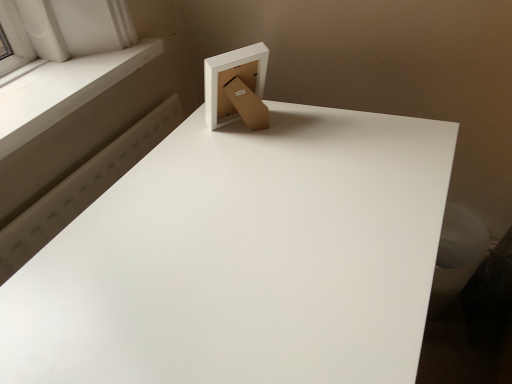
What is the approximate width of white smooth window sill at upper left?

9.32 inches.

The image size is (512, 384). Describe the element at coordinates (63, 91) in the screenshot. I see `white smooth window sill at upper left` at that location.

Find the location of a particular element. matte cardboard box at upper center is located at coordinates (232, 80).

From the image's perspective, between white matte table at upper center and white smooth window sill at upper left, who is located below?

white matte table at upper center appears lower in the image.

Between white matte table at upper center and white smooth window sill at upper left, which one is positioned in front?

white matte table at upper center is in front.

Looking at this image, who is smaller, white matte table at upper center or white smooth window sill at upper left?

With smaller size is white smooth window sill at upper left.

Considering the sizes of objects white matte table at upper center and matte cardboard box at upper center in the image provided, who is smaller, white matte table at upper center or matte cardboard box at upper center?

With smaller size is matte cardboard box at upper center.

Considering the relative sizes of white matte table at upper center and matte cardboard box at upper center in the image provided, is white matte table at upper center taller than matte cardboard box at upper center?

Yes, white matte table at upper center is taller than matte cardboard box at upper center.

Which is farther, (372, 369) or (263, 52)?

The point (263, 52) is behind.

Which of these two, white matte table at upper center or matte cardboard box at upper center, is wider?

white matte table at upper center.

Is white smooth window sill at upper left thinner than white matte table at upper center?

Yes.

Looking at the image, does white smooth window sill at upper left seem bigger or smaller compared to white matte table at upper center?

Considering their sizes, white smooth window sill at upper left takes up less space than white matte table at upper center.

Find the location of `table lying on the right of white smooth window sill at upper left`. table lying on the right of white smooth window sill at upper left is located at coordinates (244, 259).

Is white smooth window sill at upper left far from matte cardboard box at upper center?

No, white smooth window sill at upper left is in close proximity to matte cardboard box at upper center.

Which of these two, white smooth window sill at upper left or matte cardboard box at upper center, stands shorter?

With less height is white smooth window sill at upper left.

Which point is more distant from viewer, [71,90] or [208,109]?

The point [71,90] is farther from the camera.

From a real-world perspective, is white smooth window sill at upper left beneath matte cardboard box at upper center?

Yes, from a real-world perspective, white smooth window sill at upper left is beneath matte cardboard box at upper center.

From a real-world perspective, who is located higher, matte cardboard box at upper center or white smooth window sill at upper left?

matte cardboard box at upper center.

Considering the sizes of objects matte cardboard box at upper center and white smooth window sill at upper left in the image provided, who is shorter, matte cardboard box at upper center or white smooth window sill at upper left?

With less height is white smooth window sill at upper left.

Find the location of a particular element. window sill in front of the matte cardboard box at upper center is located at coordinates (63, 91).

Is matte cardboard box at upper center surrounding white matte table at upper center?

No, matte cardboard box at upper center does not contain white matte table at upper center.

Considering the relative sizes of matte cardboard box at upper center and white matte table at upper center in the image provided, is matte cardboard box at upper center wider than white matte table at upper center?

In fact, matte cardboard box at upper center might be narrower than white matte table at upper center.

In the scene shown: From the image's perspective, which is below, matte cardboard box at upper center or white matte table at upper center?

white matte table at upper center appears lower in the image.

Where is `table below the white smooth window sill at upper left (from the image's perspective)`? The height and width of the screenshot is (384, 512). table below the white smooth window sill at upper left (from the image's perspective) is located at coordinates (244, 259).

This screenshot has height=384, width=512. Find the location of `cardboard box above the white matte table at upper center (from a real-world perspective)`. cardboard box above the white matte table at upper center (from a real-world perspective) is located at coordinates (232, 80).

Based on their spatial positions, is matte cardboard box at upper center or white smooth window sill at upper left closer to white matte table at upper center?

Based on the image, matte cardboard box at upper center appears to be nearer to white matte table at upper center.

Which object lies further to the anchor point matte cardboard box at upper center, white matte table at upper center or white smooth window sill at upper left?

white smooth window sill at upper left is further to matte cardboard box at upper center.

Which object lies nearer to the anchor point white smooth window sill at upper left, matte cardboard box at upper center or white matte table at upper center?

Among the two, matte cardboard box at upper center is located nearer to white smooth window sill at upper left.

Considering their positions, is white matte table at upper center positioned further to white smooth window sill at upper left than matte cardboard box at upper center?

white matte table at upper center is further to white smooth window sill at upper left.

Which object lies nearer to the anchor point matte cardboard box at upper center, white smooth window sill at upper left or white matte table at upper center?

white matte table at upper center is closer to matte cardboard box at upper center.

When comparing their distances from white matte table at upper center, does white smooth window sill at upper left or matte cardboard box at upper center seem further?

Among the two, white smooth window sill at upper left is located further to white matte table at upper center.

Find the location of a particular element. The height and width of the screenshot is (384, 512). cardboard box between white smooth window sill at upper left and white matte table at upper center from top to bottom is located at coordinates (232, 80).